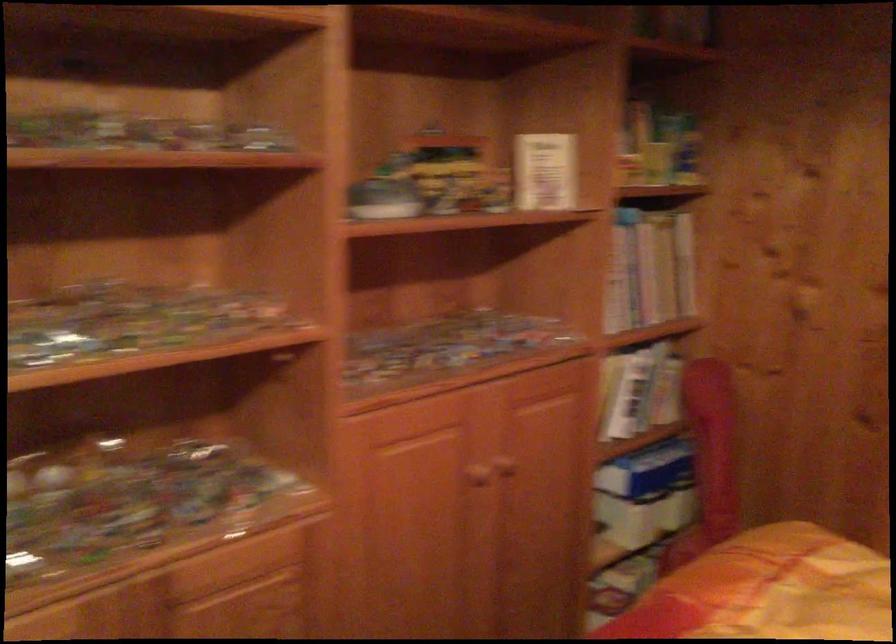
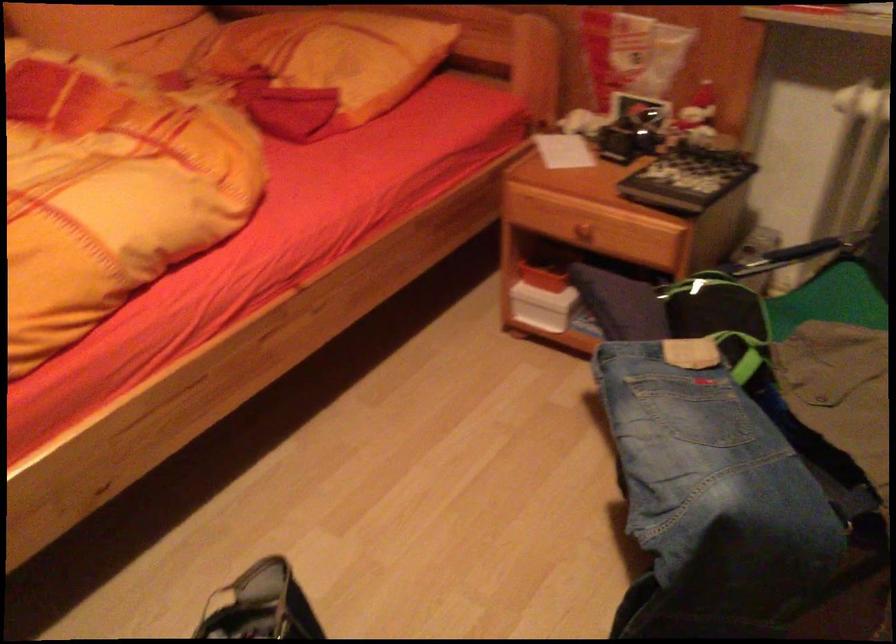
First-person continuous shooting, in which direction is the camera rotating?

The camera rotated toward right-down.